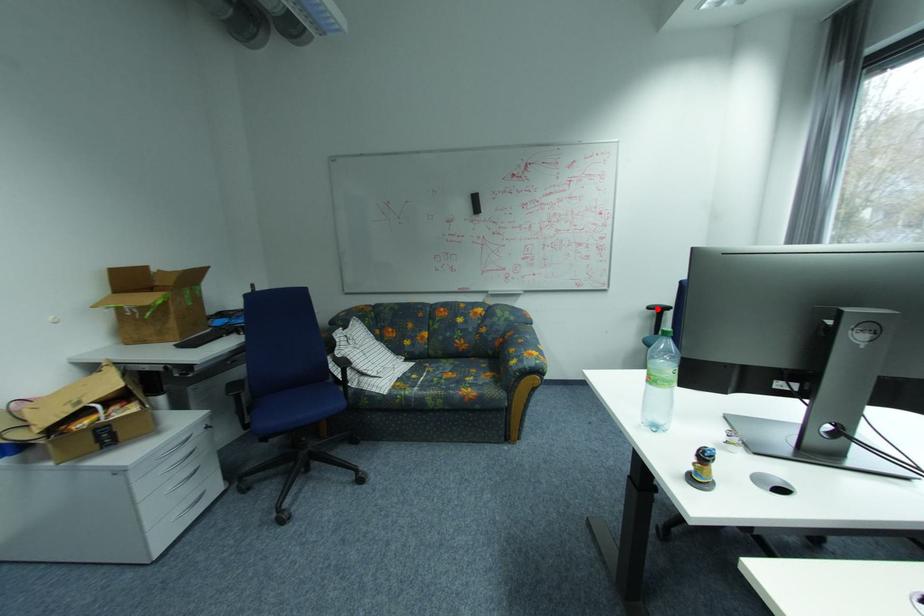
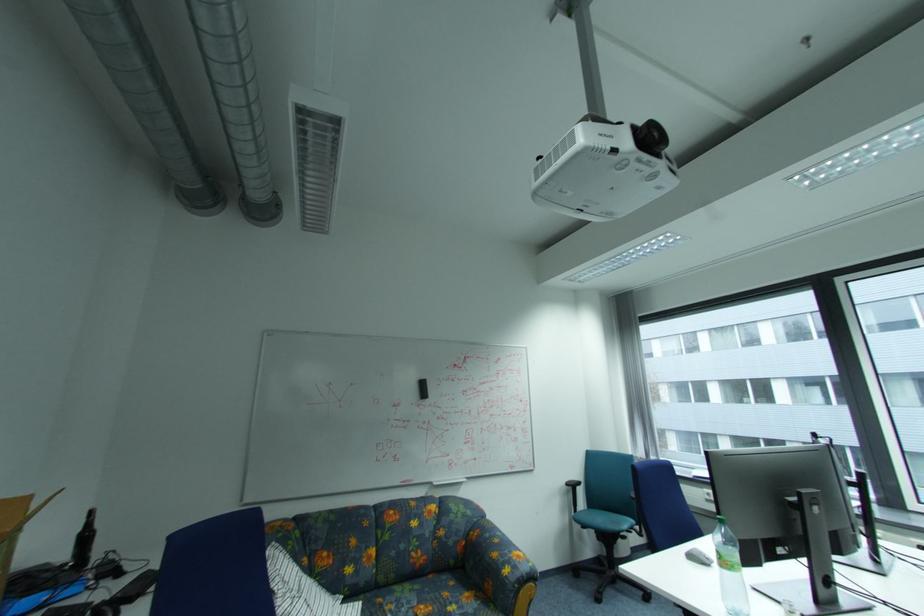
The point at the highlighted location is marked in the first image. Where is the corresponding point in the second image?

(576, 485)